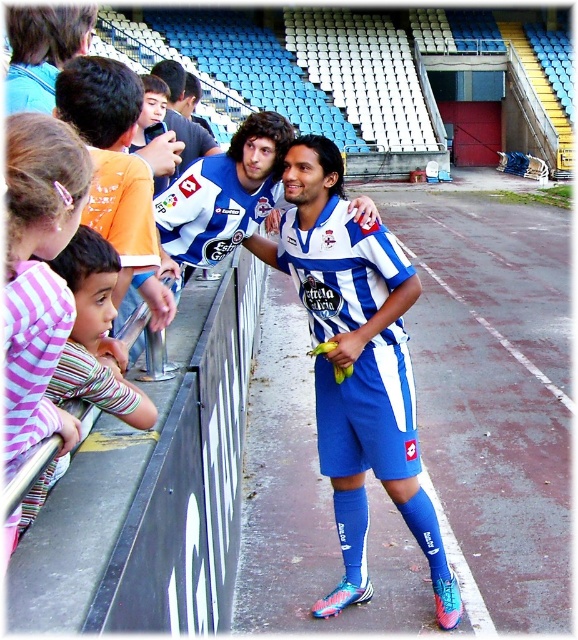
Who is taller, white and blue striped jersey at center or blue/white striped jersey at center?

white and blue striped jersey at center is taller.

Between white and blue striped jersey at center and blue/white striped jersey at center, which one has less height?

With less height is blue/white striped jersey at center.

Find the location of `white and blue striped jersey at center`. white and blue striped jersey at center is located at coordinates (357, 365).

Which is behind, point (381, 365) or point (35, 426)?

The point (381, 365) is more distant.

Does point (316, 296) lie in front of point (6, 176)?

No, (316, 296) is further to viewer.

Between point (409, 371) and point (16, 157), which one is positioned in front?

Point (16, 157)

Identify the location of white and blue striped jersey at center. This screenshot has width=578, height=640. (357, 365).

Is blue/white striped jersey at center to the left of pink striped shirt at left from the viewer's perspective?

In fact, blue/white striped jersey at center is to the right of pink striped shirt at left.

Between blue/white striped jersey at center and pink striped shirt at left, which one is positioned lower?

blue/white striped jersey at center

This screenshot has width=578, height=640. In order to click on blue/white striped jersey at center in this screenshot , I will do `click(368, 412)`.

I want to click on blue/white striped jersey at center, so click(x=368, y=412).